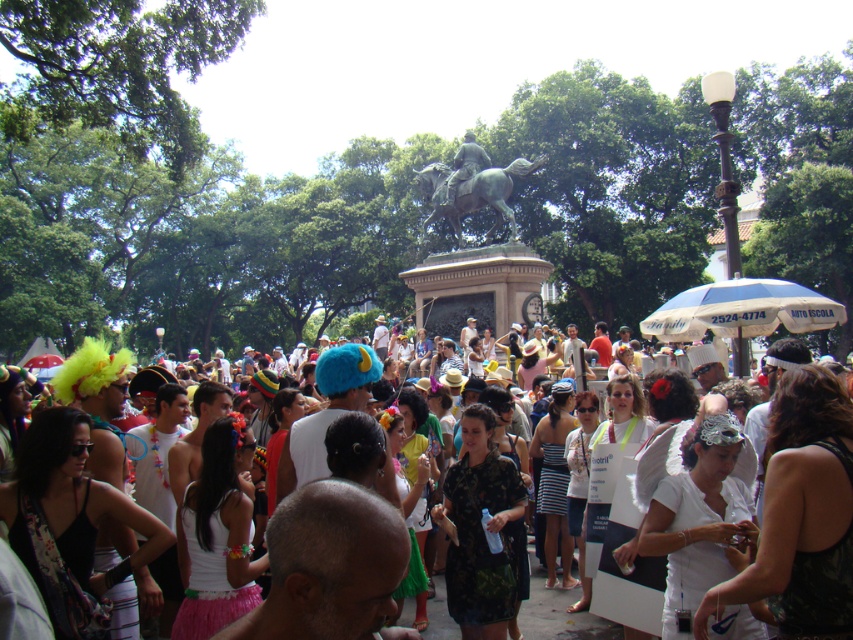
You are a photographer trying to capture the entire bronze statue at center and the white cotton crowd at center in one frame. Based on their heights, which object should you focus on first to ensure both are visible?

The bronze statue at center is taller than the white cotton crowd at center. To ensure both are visible in the frame, focus on the bronze statue at center first, as its height may require adjusting the camera angle to include its full structure while still capturing the crowd below.

You are a photographer trying to capture the bronze statue at center and the white cotton crowd at center. Based on their positions, which one would be in the background of your photo?

The bronze statue at center is located above the white cotton crowd at center, so it would be positioned in the background of the photo.

You are a photographer standing in the park and want to take a photo of both the bronze statue at center and the white cotton crowd at center. Which object will appear closer to you in the photo?

The bronze statue at center will appear closer to you in the photo because it is further to the viewer than the white cotton crowd at center.